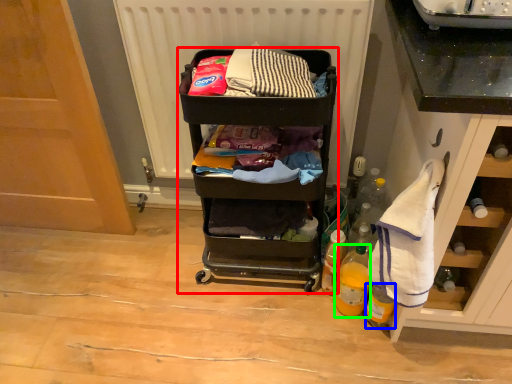
Question: Estimate the real-world distances between objects in this image. Which object is farther from furniture (highlighted by a red box), bottle (highlighted by a blue box) or bottle (highlighted by a green box)?

Choices:
 (A) bottle
 (B) bottle

Answer: (A)